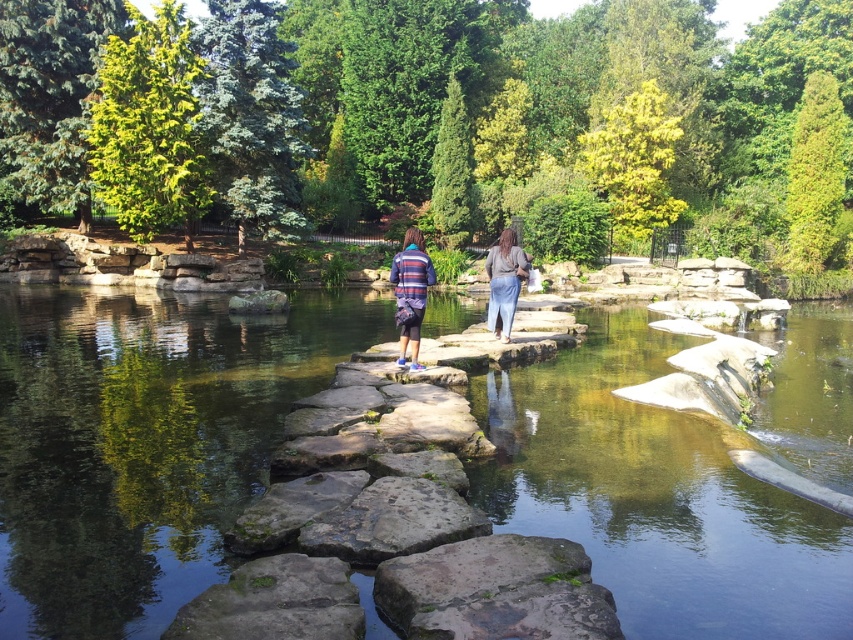
You are a photographer wanting to capture a closeup of the striped fabric jacket at center and denim pants at center. Since you want both items to be clearly visible, which one should you focus on first to ensure proper focus?

The striped fabric jacket at center has a larger size compared to denim pants at center, so you should focus on the striped fabric jacket at center first to ensure proper focus.

Looking at this image, you are a photographer trying to capture a photo of both the striped fabric jacket at center and the striped sweater at center. Since both are at the center, which one is more to the right?

The striped fabric jacket at center is more to the right than the striped sweater at center.